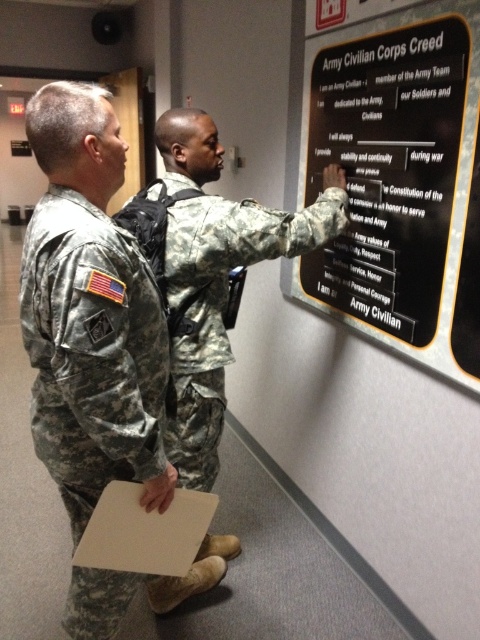
What is the exact location of the black matte sign at upper center in the image?

The black matte sign at upper center is located at point (389, 168).

You are an interior designer planning to place a new decorative item that is 1.2 meters wide on the wall where the black matte sign at upper center is currently located. Based on the scene, will the camouflage uniform at center interfere with the placement of this new item? Please explain your reasoning.

The black matte sign at upper center has a lesser width compared to the camouflage uniform at center. Since the new decorative item is 1.2 meters wide, which is wider than the current sign, it may require more space. However, the camouflage uniform at center is part of the scene but does not occupy the wall space where the sign is placed. Therefore, the uniform itself won not interfere with the placement of the new item. However, the designer should ensure there is sufficient wall space beyond the sign area